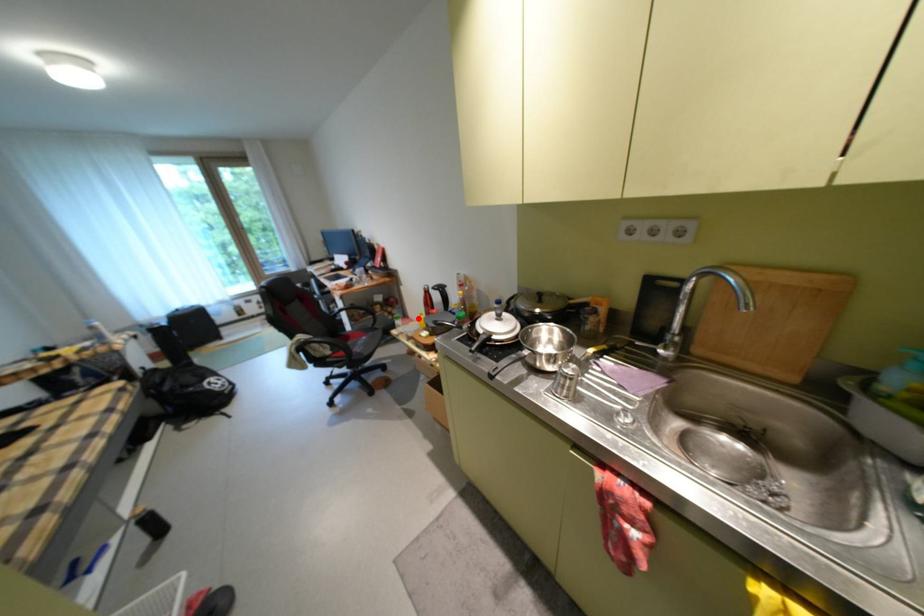
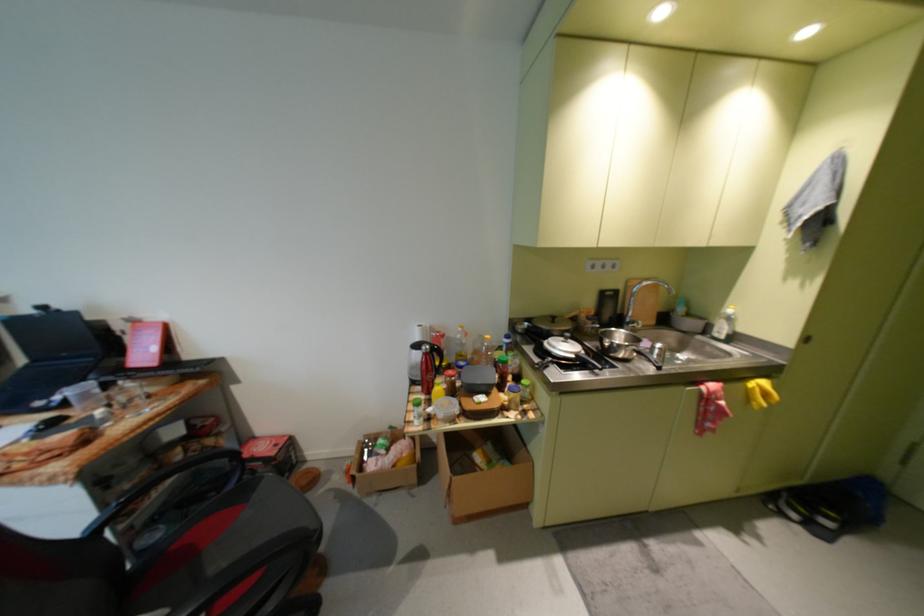
Question: I am providing you with two images of the same scene from different viewpoints. Image1 has a red point marked. In image2, the corresponding 3D location appears at what relative position? Reply with the corresponding letter.

Choices:
 (A) Closer
 (B) Farther

Answer: (A)